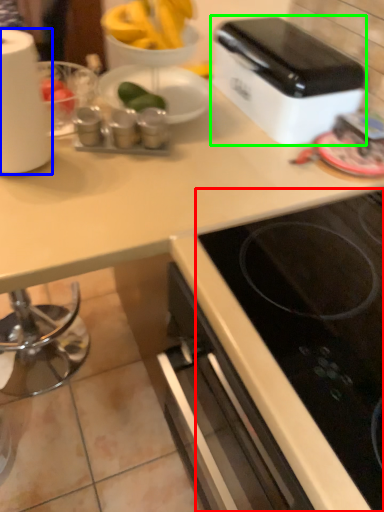
Question: Considering the real-world distances, which object is closest to gas stove (highlighted by a red box)? paper towel (highlighted by a blue box) or toaster (highlighted by a green box).

Choices:
 (A) paper towel
 (B) toaster

Answer: (B)